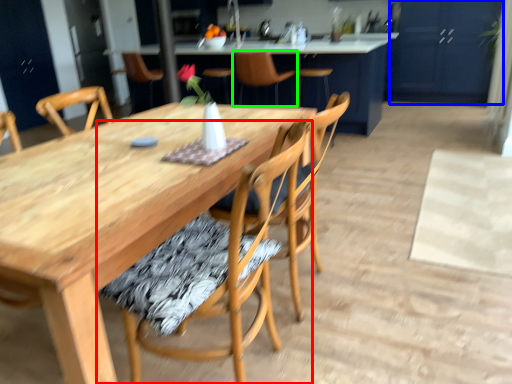
Question: Considering the real-world distances, which object is closest to chair (highlighted by a red box)? cabinetry (highlighted by a blue box) or chair (highlighted by a green box).

Choices:
 (A) cabinetry
 (B) chair

Answer: (B)